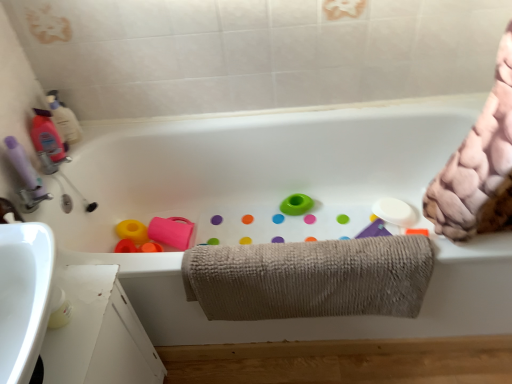
Locate an element on the screen. The width and height of the screenshot is (512, 384). vacant area that is situated to the right of translucent plastic bottle at upper left, which ranks as the third cleaning product in bottom-to-top order is located at coordinates (113, 129).